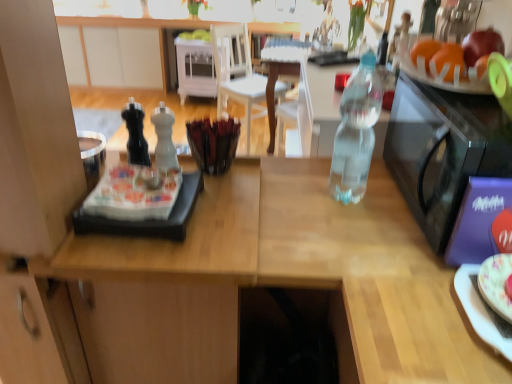
Question: Could you tell me if white matte cabinet at upper left, the first cabinetry positioned from the left, is turned towards orange matte at upper right, which ranks as the 2th orange in front-to-back order?

Choices:
 (A) yes
 (B) no

Answer: (A)

Question: From the image's perspective, would you say white matte cabinet at upper left, the first cabinetry positioned from the left, is shown under orange matte at upper right, the 1th orange from the back?

Choices:
 (A) no
 (B) yes

Answer: (A)

Question: Is white matte cabinet at upper left, marked as the second cabinetry in a right-to-left arrangement, next to orange matte at upper right, which ranks as the 2th orange in front-to-back order, and touching it?

Choices:
 (A) no
 (B) yes

Answer: (A)

Question: Can you confirm if white matte cabinet at upper left, marked as the second cabinetry in a right-to-left arrangement, is positioned to the left of orange matte at upper right, the 1th orange from the back?

Choices:
 (A) yes
 (B) no

Answer: (A)

Question: Is white matte cabinet at upper left, marked as the second cabinetry in a right-to-left arrangement, far from orange matte at upper right, which ranks as the 2th orange in front-to-back order?

Choices:
 (A) yes
 (B) no

Answer: (A)

Question: Is white matte cabinet at upper left, marked as the second cabinetry in a right-to-left arrangement, not inside orange matte at upper right, which ranks as the 2th orange in front-to-back order?

Choices:
 (A) yes
 (B) no

Answer: (A)

Question: From the image's perspective, is white wood cabinet at center, placed as the 2th cabinetry when sorted from left to right, below orange matte at upper right, placed as the second orange when sorted from back to front?

Choices:
 (A) no
 (B) yes

Answer: (A)

Question: Considering the relative sizes of white wood cabinet at center, positioned as the first cabinetry in right-to-left order, and orange matte at upper right, placed as the second orange when sorted from back to front, in the image provided, is white wood cabinet at center, positioned as the first cabinetry in right-to-left order, thinner than orange matte at upper right, placed as the second orange when sorted from back to front,?

Choices:
 (A) no
 (B) yes

Answer: (A)

Question: Does white wood cabinet at center, placed as the 2th cabinetry when sorted from left to right, have a greater height compared to orange matte at upper right, placed as the second orange when sorted from back to front?

Choices:
 (A) yes
 (B) no

Answer: (A)

Question: Can you confirm if white wood cabinet at center, placed as the 2th cabinetry when sorted from left to right, is wider than orange matte at upper right, acting as the 1th orange starting from the front?

Choices:
 (A) yes
 (B) no

Answer: (A)

Question: From a real-world perspective, is white wood cabinet at center, positioned as the first cabinetry in right-to-left order, located beneath orange matte at upper right, acting as the 1th orange starting from the front?

Choices:
 (A) no
 (B) yes

Answer: (B)

Question: Is the surface of white wood cabinet at center, positioned as the first cabinetry in right-to-left order, in direct contact with orange matte at upper right, placed as the second orange when sorted from back to front?

Choices:
 (A) no
 (B) yes

Answer: (A)

Question: Considering the relative positions of white wood chair at center and orange matte at upper right, placed as the second orange when sorted from back to front, in the image provided, is white wood chair at center to the right of orange matte at upper right, placed as the second orange when sorted from back to front, from the viewer's perspective?

Choices:
 (A) no
 (B) yes

Answer: (A)